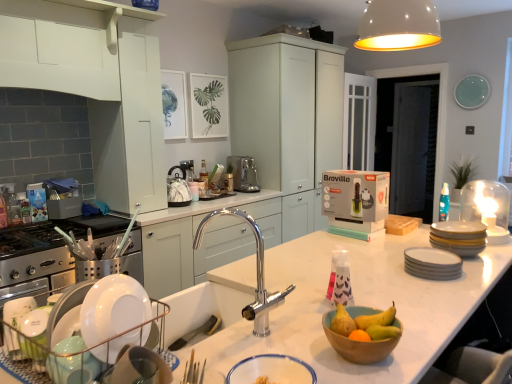
Question: Is matte white cabinets at center, which appears as the 1th cabinetry when viewed from the back, taller or shorter than white matte light fixture at upper center?

Choices:
 (A) tall
 (B) short

Answer: (A)

Question: From a real-world perspective, is matte white cabinets at center, which appears as the 1th cabinetry when viewed from the back, positioned above or below white matte light fixture at upper center?

Choices:
 (A) below
 (B) above

Answer: (A)

Question: Which object is the closest to the stainless steel gas stove at left?

Choices:
 (A) matte yellow pear at center, which ranks as the first fruit in left-to-right order
 (B) translucent plastic bottle at left
 (C) white glossy bowl at lower center, arranged as the first basin when viewed from the left
 (D) white matte plates at right
 (E) white matte cabinet at upper left, placed as the second cabinetry when sorted from front to back

Answer: (B)

Question: Estimate the real-world distances between objects in this image. Which object is closer to the white glossy bowl at lower center, the 1th basin when ordered from front to back?

Choices:
 (A) white matte cabinet at upper left, marked as the 1th cabinetry in a front-to-back arrangement
 (B) stainless steel gas stove at left
 (C) yellow matte plates at right, which is the second appliance in left-to-right order
 (D) translucent plastic bottle at left
 (E) satin nickel coffee maker at center

Answer: (C)